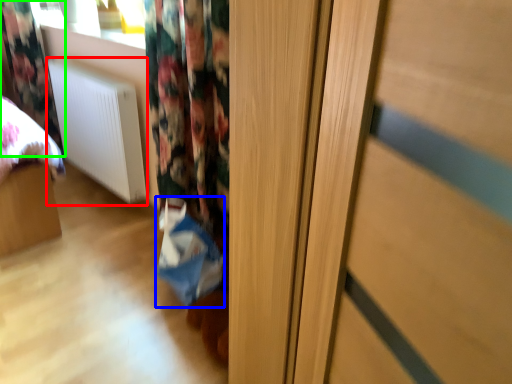
Question: Which object is the farthest from radiator (highlighted by a red box)? Choose among these: shopping bag (highlighted by a blue box) or curtain (highlighted by a green box).

Choices:
 (A) shopping bag
 (B) curtain

Answer: (A)